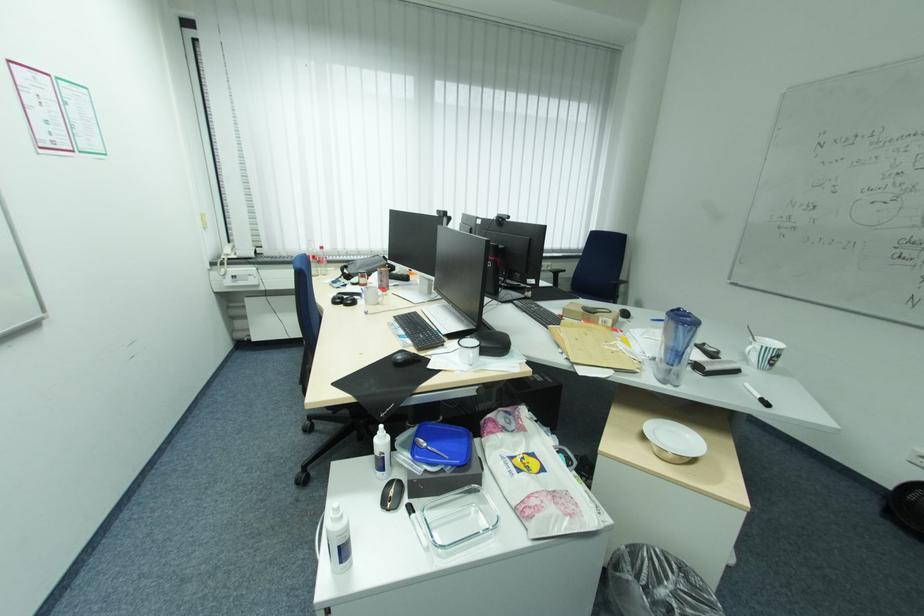
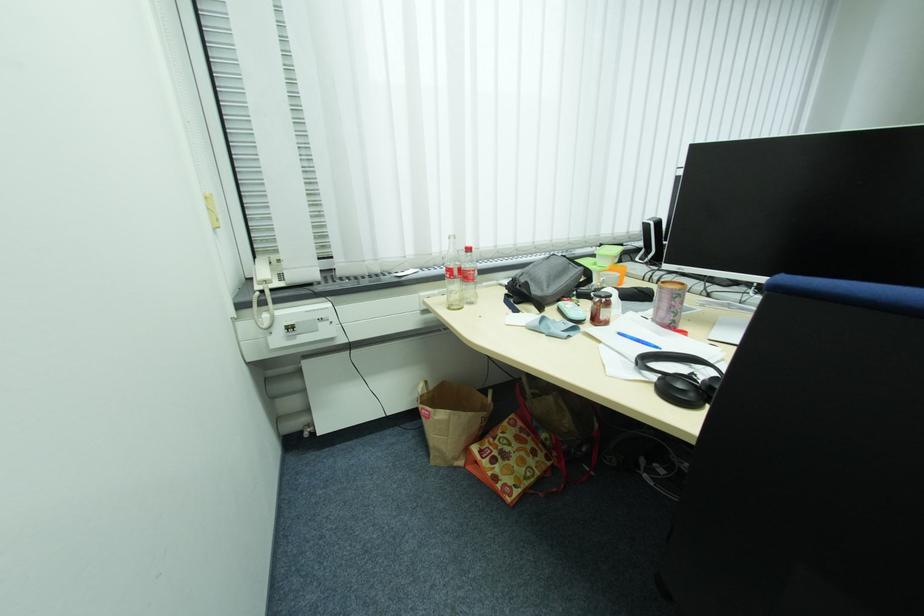
Where in the second image is the point corresponding to (x=236, y=243) from the first image?

(261, 256)